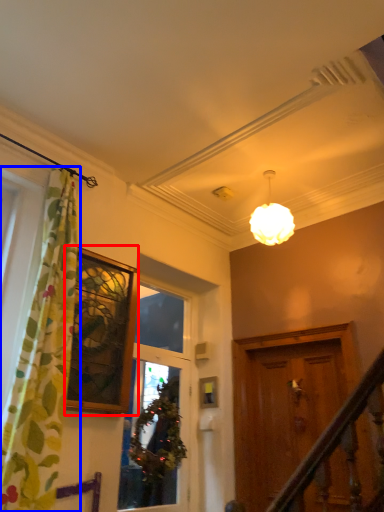
Question: Which of the following is the farthest to the observer, window (highlighted by a red box) or curtain (highlighted by a blue box)?

Choices:
 (A) window
 (B) curtain

Answer: (A)